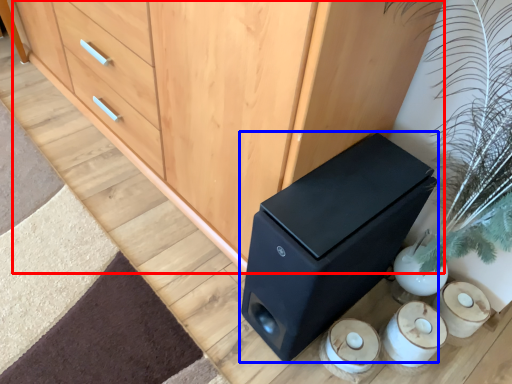
Question: Which object appears farthest to the camera in this image, chest of drawers (highlighted by a red box) or furniture (highlighted by a blue box)?

Choices:
 (A) chest of drawers
 (B) furniture

Answer: (B)